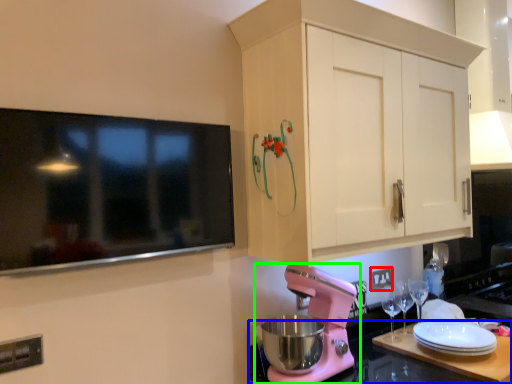
Question: Considering the real-world distances, which object is farthest from electric outlet (highlighted by a red box)? countertop (highlighted by a blue box) or mixer (highlighted by a green box)?

Choices:
 (A) countertop
 (B) mixer

Answer: (B)